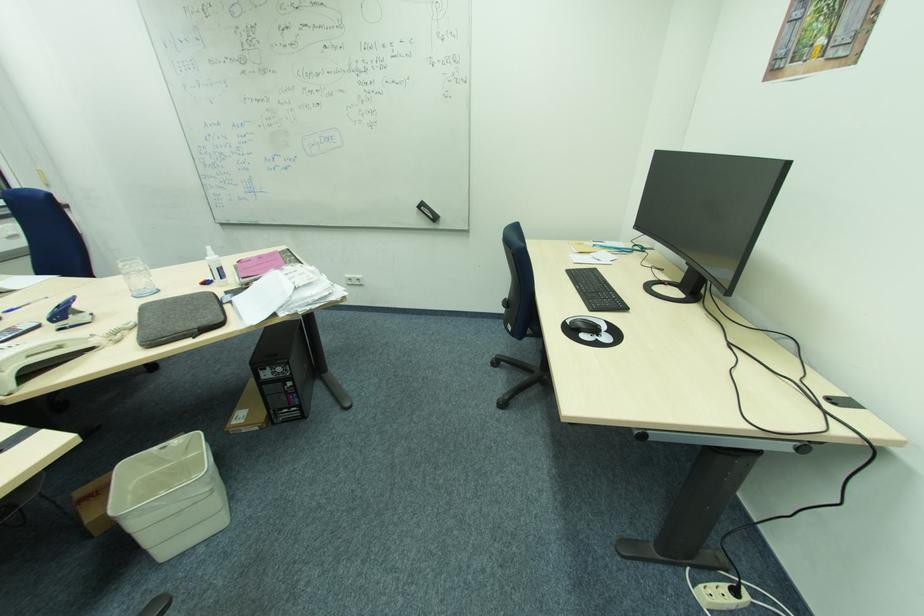
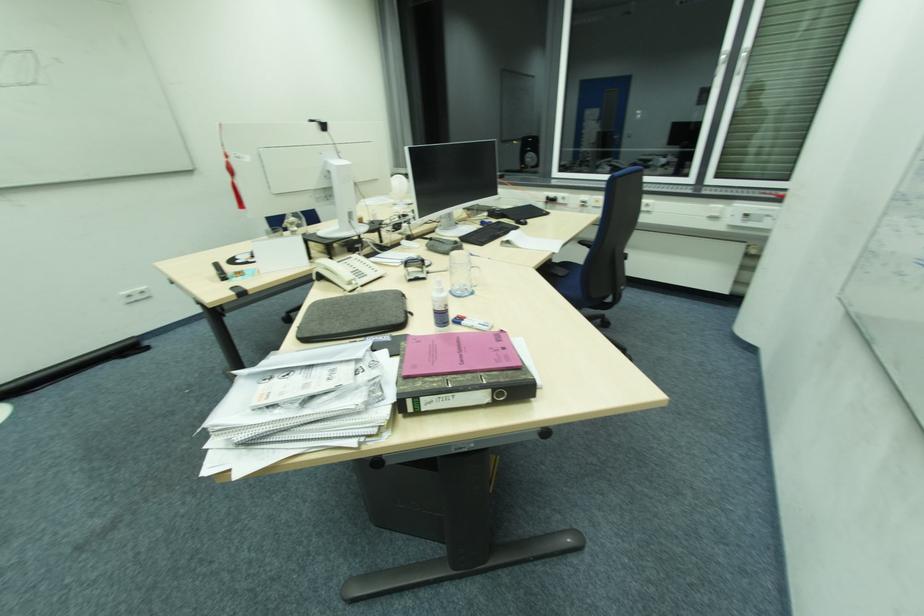
The point at (222, 306) is marked in the first image. Where is the corresponding point in the second image?

(348, 331)